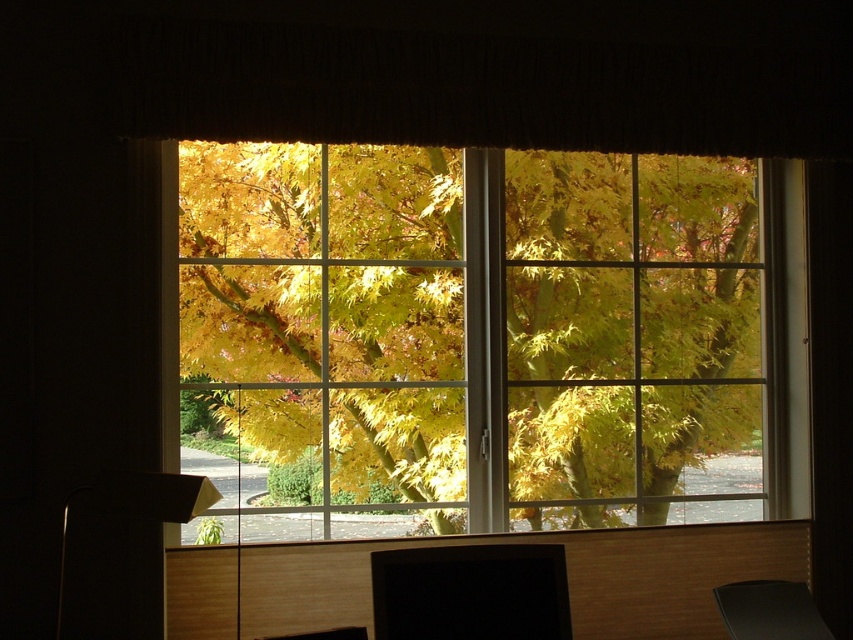
Question: Can you confirm if yellow/golden leaves at center is smaller than black glossy monitor at lower center?

Choices:
 (A) yes
 (B) no

Answer: (B)

Question: Does yellow/golden leaves at center come behind black plastic lamp at lower left?

Choices:
 (A) no
 (B) yes

Answer: (B)

Question: Which of the following is the farthest from the observer?

Choices:
 (A) black glossy monitor at lower center
 (B) black plastic lamp at lower left

Answer: (A)

Question: Can you confirm if yellow/golden leaves at center is wider than black glossy monitor at lower center?

Choices:
 (A) no
 (B) yes

Answer: (B)

Question: Which object is positioned closest to the yellow/golden leaves at center?

Choices:
 (A) black plastic lamp at lower left
 (B) black glossy monitor at lower center

Answer: (B)

Question: Among these points, which one is nearest to the camera?

Choices:
 (A) (136, 620)
 (B) (625, 488)

Answer: (A)